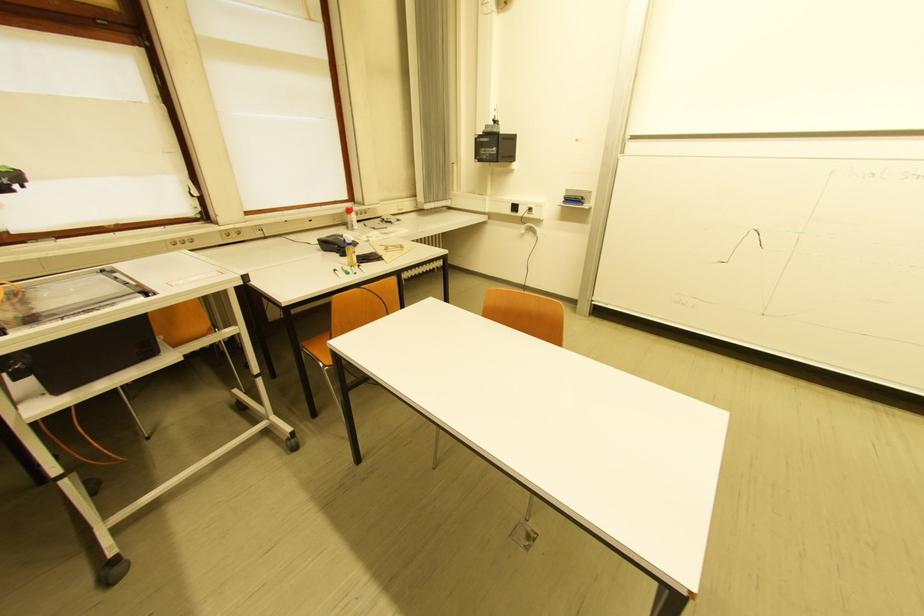
Describe the element at coordinates (335, 243) in the screenshot. I see `the telephone handset` at that location.